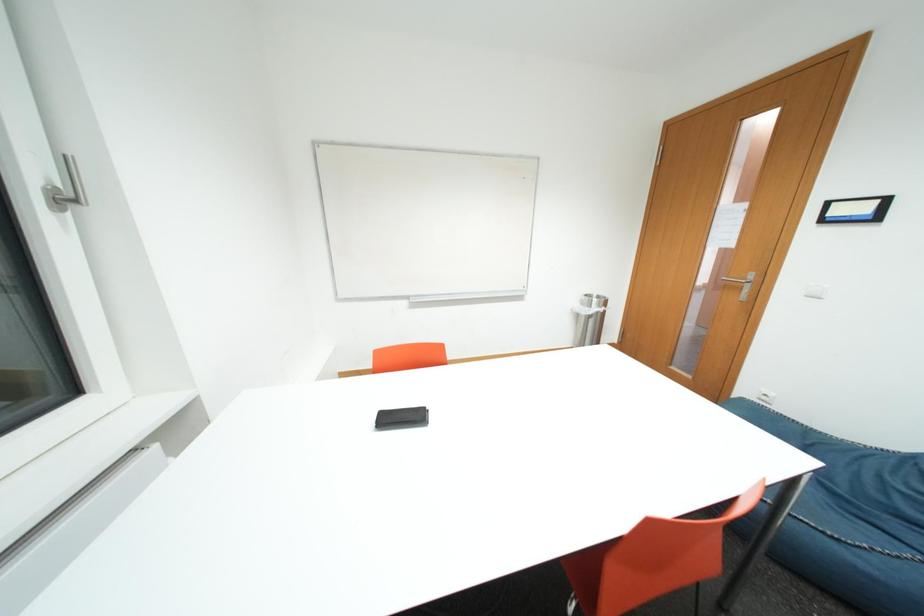
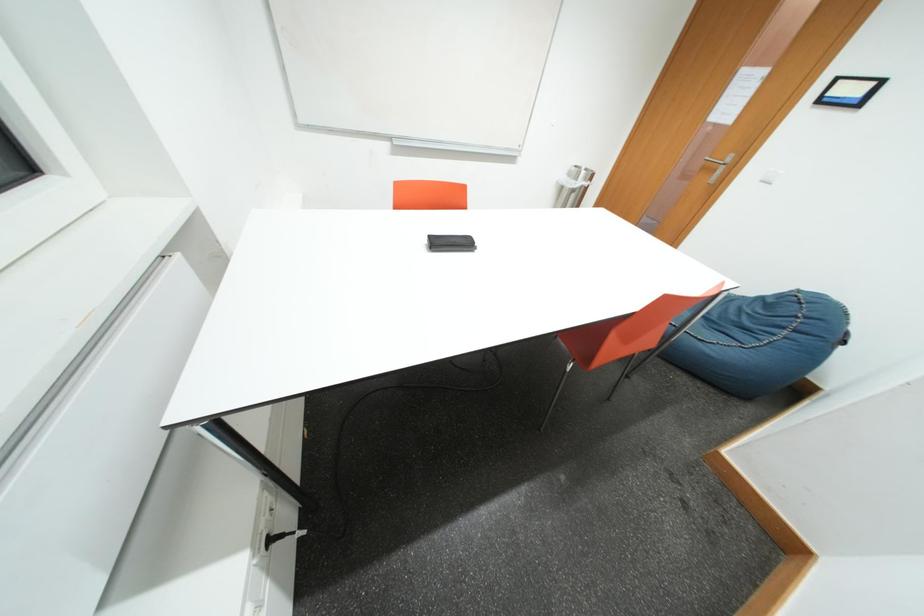
Question: What movement of the cameraman would produce the second image?

Choices:
 (A) Left
 (B) Right
 (C) Forward
 (D) Backward

Answer: (A)